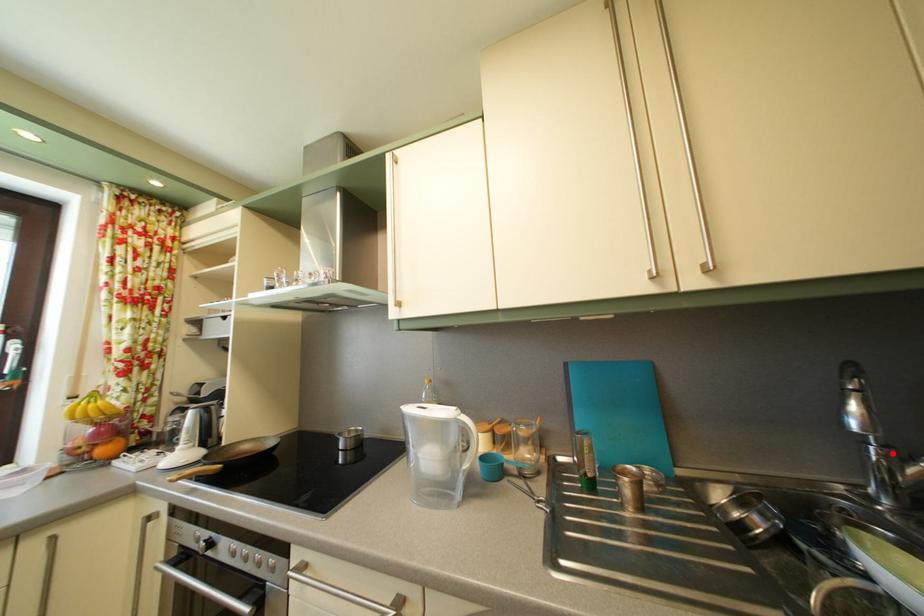
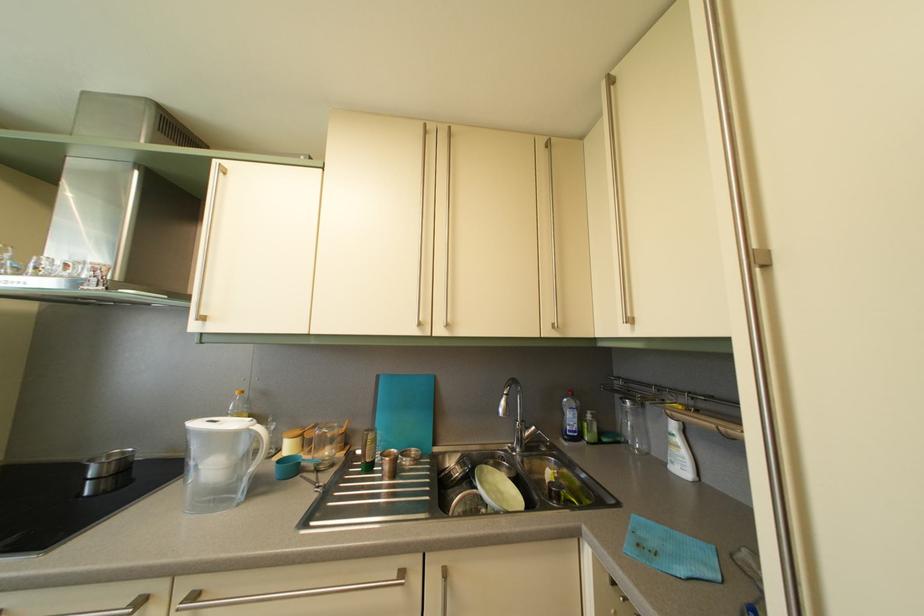
Where in the second image is the point corresponding to the highlighted location from the first image?

(530, 429)